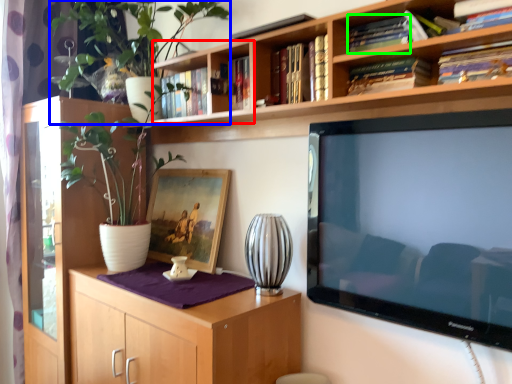
Question: Which object is the farthest from shelf (highlighted by a red box)? Choose among these: plant (highlighted by a blue box) or book (highlighted by a green box).

Choices:
 (A) plant
 (B) book

Answer: (B)